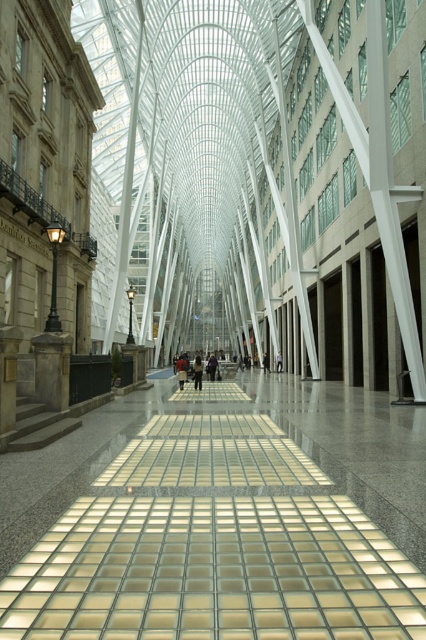
Between translucent glass floor at center and dark blue jeans at center, which one appears on the left side from the viewer's perspective?

translucent glass floor at center

Is translucent glass floor at center shorter than dark blue jeans at center?

Yes, translucent glass floor at center is shorter than dark blue jeans at center.

Where is `translucent glass floor at center`? The height and width of the screenshot is (640, 426). translucent glass floor at center is located at coordinates (221, 516).

Is brown leather jacket at center below dark clothing at center?

Yes, brown leather jacket at center is below dark clothing at center.

Between brown leather jacket at center and dark clothing at center, which one appears on the right side from the viewer's perspective?

From the viewer's perspective, dark clothing at center appears more on the right side.

Is point (183, 385) closer to viewer compared to point (195, 371)?

That is False.

Where is `brown leather jacket at center`? Image resolution: width=426 pixels, height=640 pixels. brown leather jacket at center is located at coordinates (181, 371).

Which is above, translucent glass floor at center or brown leather jacket at center?

translucent glass floor at center is higher up.

Which is behind, point (57, 520) or point (180, 355)?

The point (180, 355) is behind.

Does point (405, 560) lie in front of point (181, 372)?

Yes, point (405, 560) is closer to viewer.

You are a GUI agent. You are given a task and a screenshot of the screen. Output one action in this format:
    pyautogui.click(x=<x>, y=<y>)
    Task: Click on the translucent glass floor at center
    
    Given the screenshot: What is the action you would take?
    pyautogui.click(x=221, y=516)